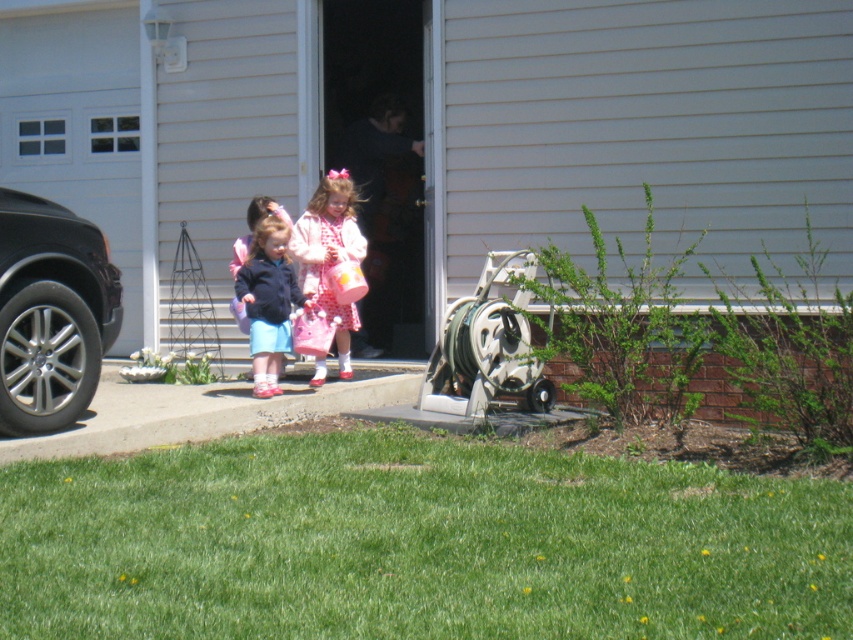
Based on the photo, you are a delivery person trying to park your van next to the shiny black car at left. The parking space is only wide enough for vehicles up to the width of the pink satin dress at center. Can you safely park your van there?

The shiny black car at left is wider than the pink satin dress at center, so the parking space may not be wide enough for your van since the car is already occupying more space than the allowed width limit.

You are a delivery person trying to park your van behind the shiny black car at left and the metallic gray hose reel at lower center. Can you drive straight back from the driveway to park there without moving any objects?

The shiny black car at left is in front of the metallic gray hose reel at lower center, so the path behind the shiny black car at left would be blocked by the metallic gray hose reel at lower center. You cannot drive straight back to park there without moving objects.